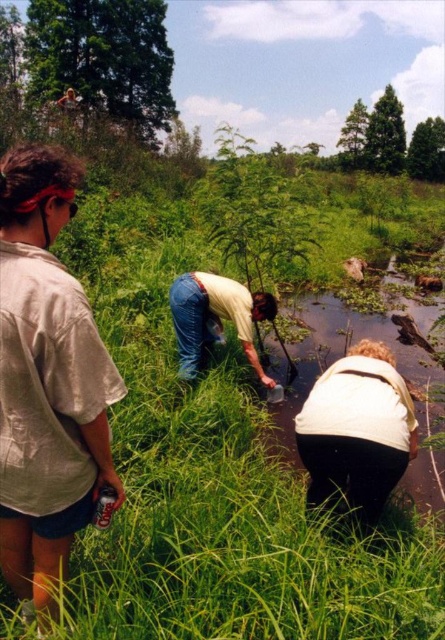
You are a photographer trying to capture a group photo of the white matte shirt at lower right and the blue jeans at center. Based on their current positions, can you position yourself so that both subjects are fully visible in the frame without any part of them being cut off?

The white matte shirt at lower right is positioned under the blue jeans at center. To ensure both are fully visible, you should position yourself below the blue jeans at center so that you can capture the white matte shirt at lower right without obstruction.